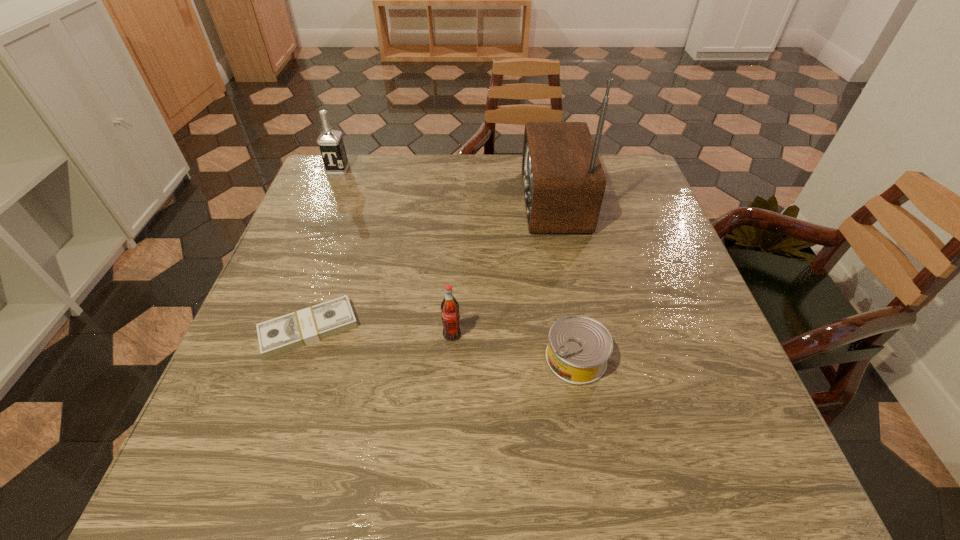
Locate an element on the screen. blank space that satisfies the following two spatial constraints: 1. on the front-facing side of the tallest object; 2. on the label of the soda bottle is located at coordinates (577, 335).

Locate an element on the screen. This screenshot has height=540, width=960. vacant space that satisfies the following two spatial constraints: 1. on the front-facing side of the tallest object; 2. on the label of the third object from left to right is located at coordinates coord(577,335).

Find the location of `vacant region that satisfies the following two spatial constraints: 1. on the front label of the vodka; 2. on the right side of the second shortest object`. vacant region that satisfies the following two spatial constraints: 1. on the front label of the vodka; 2. on the right side of the second shortest object is located at coordinates (262, 358).